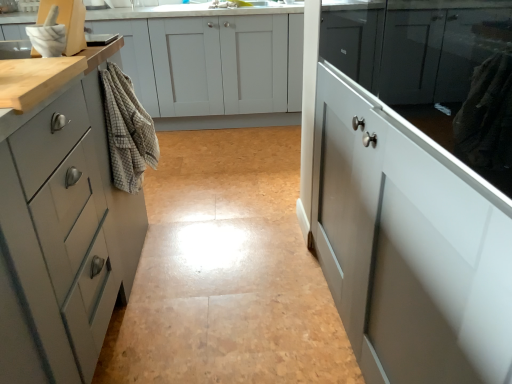
Question: From a real-world perspective, is matte gray cabinet at left, acting as the second cabinetry starting from the back, positioned under matte white cabinets at center, which ranks as the fourth cabinetry in front-to-back order, based on gravity?

Choices:
 (A) no
 (B) yes

Answer: (A)

Question: Is matte gray cabinet at left, acting as the third cabinetry starting from the front, next to matte white cabinets at center, which ranks as the fourth cabinetry in front-to-back order?

Choices:
 (A) yes
 (B) no

Answer: (B)

Question: Is the depth of matte gray cabinet at left, acting as the third cabinetry starting from the front, less than that of matte white cabinets at center, the first cabinetry from the back?

Choices:
 (A) no
 (B) yes

Answer: (B)

Question: Does matte gray cabinet at left, acting as the second cabinetry starting from the back, have a smaller size compared to matte white cabinets at center, the first cabinetry from the back?

Choices:
 (A) yes
 (B) no

Answer: (A)

Question: From the image's perspective, would you say matte gray cabinet at left, acting as the second cabinetry starting from the back, is shown under matte white cabinets at center, which ranks as the fourth cabinetry in front-to-back order?

Choices:
 (A) yes
 (B) no

Answer: (A)

Question: Is point (279, 3) closer or farther from the camera than point (362, 240)?

Choices:
 (A) closer
 (B) farther

Answer: (B)

Question: From a real-world perspective, is brushed metal faucet at upper center, marked as the first faucet in a right-to-left arrangement, positioned above or below matte white cabinet at right, which is counted as the 3th cabinetry, starting from the back?

Choices:
 (A) above
 (B) below

Answer: (A)

Question: Based on their sizes in the image, would you say brushed metal faucet at upper center, which is the 2th faucet in back-to-front order, is bigger or smaller than matte white cabinet at right, which is counted as the 3th cabinetry, starting from the back?

Choices:
 (A) small
 (B) big

Answer: (A)

Question: From their relative heights in the image, would you say brushed metal faucet at upper center, which appears as the 2th faucet when viewed from the left, is taller or shorter than matte white cabinet at right, marked as the 2th cabinetry in a front-to-back arrangement?

Choices:
 (A) short
 (B) tall

Answer: (A)

Question: Considering the relative positions of beige checkered towel at left and matte white cabinets at center, the first cabinetry from the back, in the image provided, is beige checkered towel at left to the left or to the right of matte white cabinets at center, the first cabinetry from the back,?

Choices:
 (A) left
 (B) right

Answer: (B)

Question: Considering their positions, is beige checkered towel at left located in front of or behind matte white cabinets at center, which ranks as the fourth cabinetry in front-to-back order?

Choices:
 (A) front
 (B) behind

Answer: (A)

Question: Is beige checkered towel at left taller or shorter than matte white cabinets at center, the first cabinetry from the back?

Choices:
 (A) short
 (B) tall

Answer: (A)

Question: Is beige checkered towel at left spatially inside matte white cabinets at center, the first cabinetry from the back, or outside of it?

Choices:
 (A) outside
 (B) inside

Answer: (A)

Question: From the image's perspective, is matte white cabinets at center, the first cabinetry from the back, located above or below brushed metal faucet at upper center, which appears as the 2th faucet when viewed from the left?

Choices:
 (A) above
 (B) below

Answer: (B)

Question: In terms of height, does matte white cabinets at center, which ranks as the fourth cabinetry in front-to-back order, look taller or shorter compared to brushed metal faucet at upper center, the first faucet from the front?

Choices:
 (A) short
 (B) tall

Answer: (B)